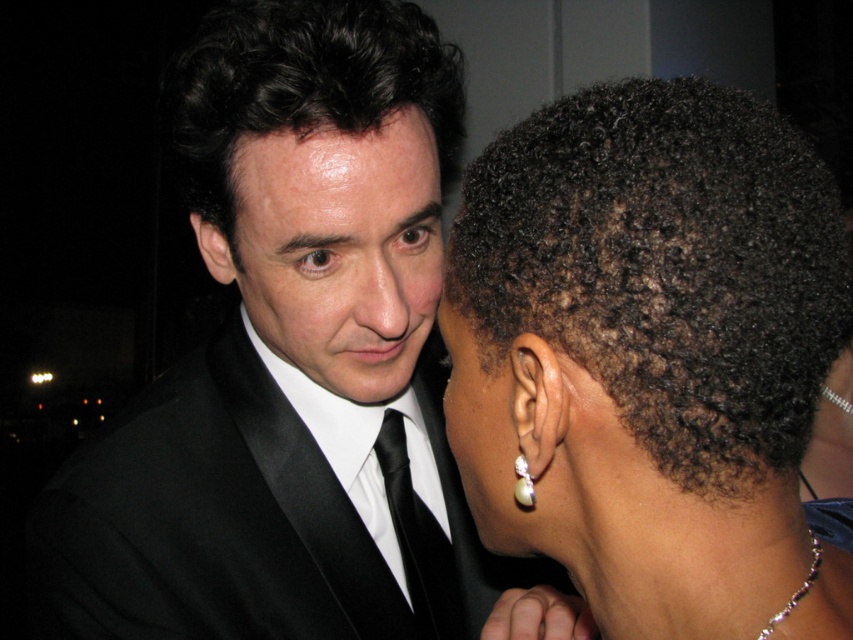
You are a photographer at a formal event. You notice two reflective surfaces in your frame, the shiny skin forehead at upper center and the pearl earrings at center. Which reflective surface is closer to your camera?

The shiny skin forehead at upper center is closer to the camera because it is further to the viewer than the pearl earrings at center.

You are a photographer at this event and want to ensure both the black satin tie at center and pearl earrings at center are clearly visible in your photo. Given their sizes, which one might require more careful framing to avoid being too small in the shot?

The pearl earrings at center are smaller than the black satin tie at center, so they might require more careful framing to avoid being too small in the shot.

You are a photographer at a formal event. You need to capture a close portrait of both the black satin tie at center and the pearl earrings at center. Which object should you focus on first if you want to ensure both are in frame without moving the camera?

The black satin tie at center is positioned on the left side of pearl earrings at center. Since the photographer wants to capture both without moving the camera, focusing on the black satin tie at center first ensures the pearl earrings at center will also be in frame as they are to the right of the tie.